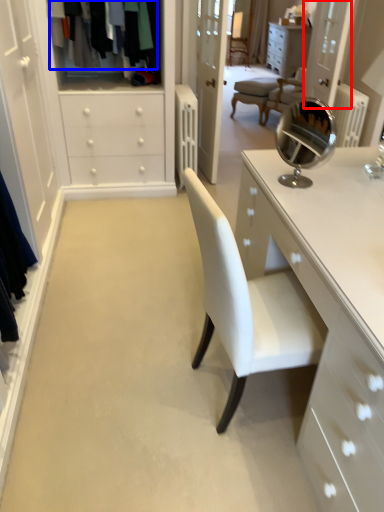
Question: Which object appears closest to the camera in this image, glass door (highlighted by a red box) or clothing (highlighted by a blue box)?

Choices:
 (A) glass door
 (B) clothing

Answer: (B)